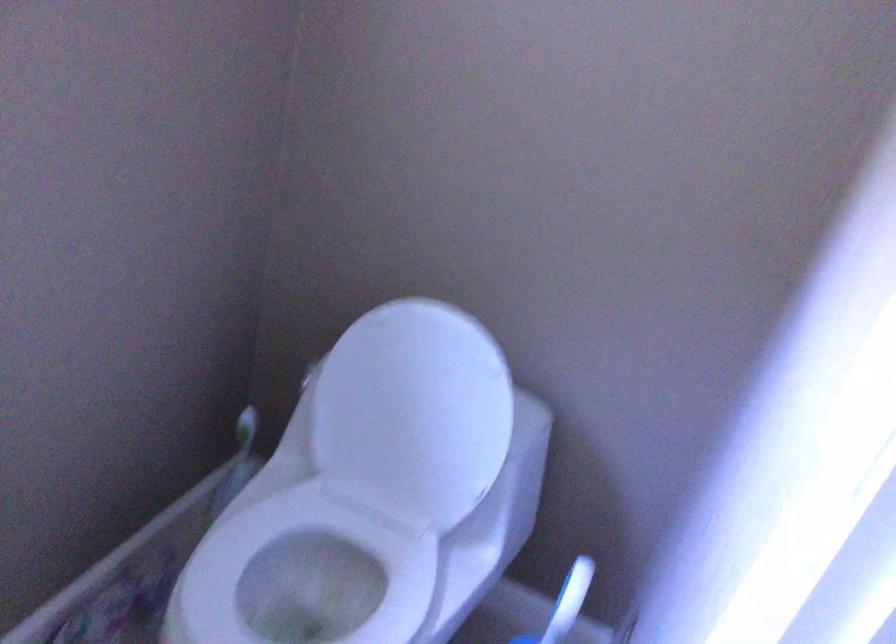
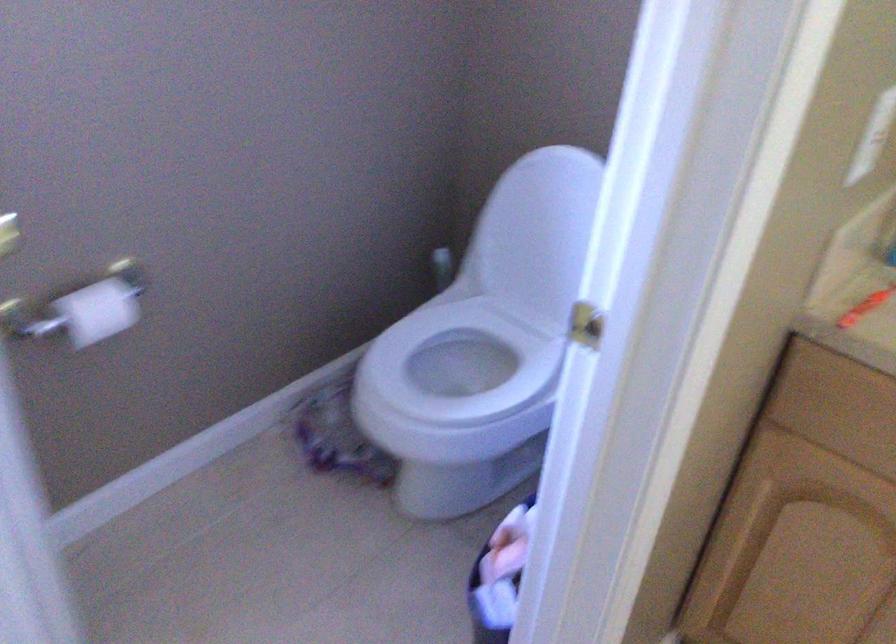
In the second image, find the point that corresponds to (x=253, y=430) in the first image.

(442, 268)